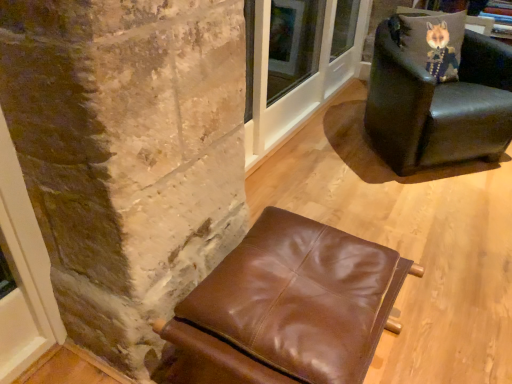
Question: Is brown leather ottoman at lower center, which appears as the 1th chair when ordered from the bottom, surrounding velvet fox pillow at upper right?

Choices:
 (A) yes
 (B) no

Answer: (B)

Question: From a real-world perspective, is brown leather ottoman at lower center, the first chair in the left-to-right sequence, located beneath velvet fox pillow at upper right?

Choices:
 (A) yes
 (B) no

Answer: (A)

Question: Is brown leather ottoman at lower center, the first chair in the left-to-right sequence, thinner than velvet fox pillow at upper right?

Choices:
 (A) no
 (B) yes

Answer: (A)

Question: From the image's perspective, is brown leather ottoman at lower center, acting as the second chair starting from the right, on velvet fox pillow at upper right?

Choices:
 (A) no
 (B) yes

Answer: (A)

Question: Does brown leather ottoman at lower center, the second chair positioned from the back, have a greater width compared to velvet fox pillow at upper right?

Choices:
 (A) yes
 (B) no

Answer: (A)

Question: From the image's perspective, relative to velvet fox pillow at upper right, is leather armchair at upper right, the first chair viewed from the right, above or below?

Choices:
 (A) above
 (B) below

Answer: (B)

Question: In the image, is leather armchair at upper right, the 2th chair from the left, positioned in front of or behind velvet fox pillow at upper right?

Choices:
 (A) behind
 (B) front

Answer: (B)

Question: In terms of height, does leather armchair at upper right, marked as the first chair in a back-to-front arrangement, look taller or shorter compared to velvet fox pillow at upper right?

Choices:
 (A) tall
 (B) short

Answer: (A)

Question: Is leather armchair at upper right, the first chair viewed from the right, wider or thinner than velvet fox pillow at upper right?

Choices:
 (A) wide
 (B) thin

Answer: (A)

Question: From a real-world perspective, is velvet fox pillow at upper right positioned above or below leather armchair at upper right, the first chair viewed from the right?

Choices:
 (A) below
 (B) above

Answer: (B)

Question: Is velvet fox pillow at upper right in front of or behind leather armchair at upper right, the second chair ordered from the bottom, in the image?

Choices:
 (A) behind
 (B) front

Answer: (A)

Question: Is velvet fox pillow at upper right to the left or to the right of leather armchair at upper right, marked as the 2th chair in a front-to-back arrangement, in the image?

Choices:
 (A) right
 (B) left

Answer: (B)

Question: From the image's perspective, is velvet fox pillow at upper right positioned above or below leather armchair at upper right, the first chair viewed from the right?

Choices:
 (A) below
 (B) above

Answer: (B)

Question: Considering the positions of brown leather ottoman at lower center, which appears as the 1th chair when ordered from the bottom, and velvet fox pillow at upper right in the image, is brown leather ottoman at lower center, which appears as the 1th chair when ordered from the bottom, wider or thinner than velvet fox pillow at upper right?

Choices:
 (A) thin
 (B) wide

Answer: (B)

Question: From a real-world perspective, is brown leather ottoman at lower center, which appears as the 1th chair when ordered from the bottom, positioned above or below velvet fox pillow at upper right?

Choices:
 (A) below
 (B) above

Answer: (A)